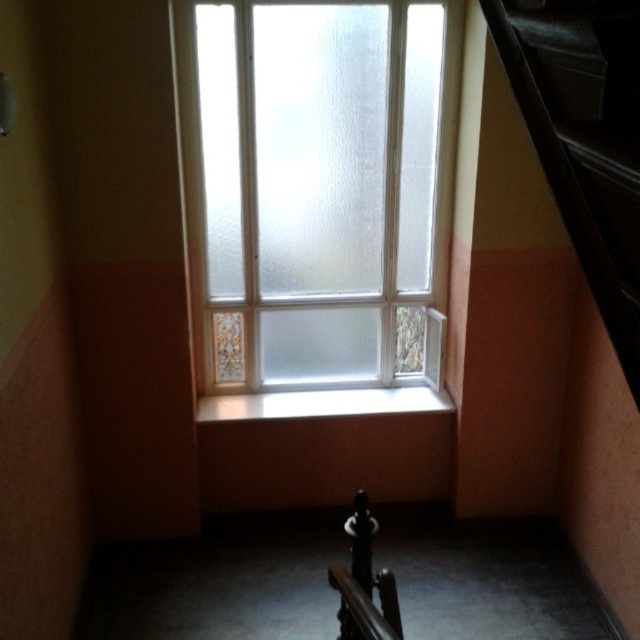
You are standing in the room and want to place a potted plant on the white glossy window sill at center. However, you notice the black leather stairs at right are blocking the path. Can you move the plant to the window sill without moving the stairs?

The black leather stairs at right is to the right of white glossy window sill at center, so you can reach the white glossy window sill at center by approaching from the left side of the stairs, allowing you to place the potted plant there without moving the stairs.

You are standing in the room looking at the window. There are two points marked on the window, one at point coordinates point (550, 166) and the other at point coordinates point (268, 412). Which point is closer to you?

Point (550, 166) is closer to the viewer than point (268, 412).

You are standing in the room and want to move from the frosted glass window at upper center to the polished dark wood handrail at lower center. Which direction should you move to reach the handrail?

The frosted glass window at upper center is positioned on the left side of the polished dark wood handrail at lower center, so you should move to the right to reach the handrail.